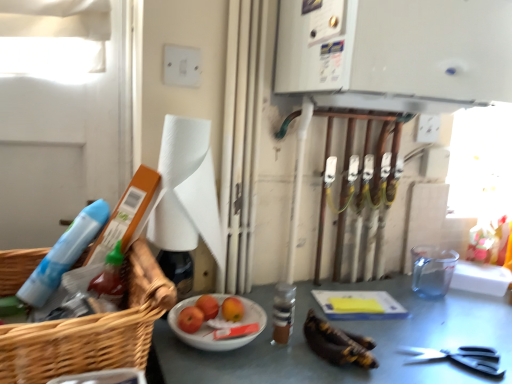
Question: Would you say white paper towel at center is inside or outside smooth red apple at center, placed as the second fruit when sorted from front to back?

Choices:
 (A) outside
 (B) inside

Answer: (A)

Question: In terms of size, does white paper towel at center appear bigger or smaller than smooth red apple at center, placed as the second fruit when sorted from front to back?

Choices:
 (A) big
 (B) small

Answer: (A)

Question: Estimate the real-world distances between objects in this image. Which object is farther from the smooth red apple at center, which is counted as the first fruit, starting from the back?

Choices:
 (A) white glossy bowl at center
 (B) shiny red apples at center, which is counted as the 2th fruit, starting from the back
 (C) black plastic scissors at lower right
 (D) blue plastic spray bottle at left
 (E) woven wood basket at left

Answer: (C)

Question: Estimate the real-world distances between objects in this image. Which object is farther from the smooth red apple at center, placed as the second fruit when sorted from front to back?

Choices:
 (A) shiny red apples at center, which is counted as the 2th fruit, starting from the back
 (B) black plastic scissors at lower right
 (C) white glossy bowl at center
 (D) brown glass bottle at center
 (E) white paper towel at center

Answer: (B)